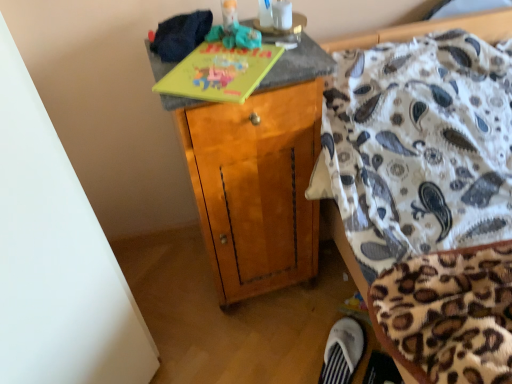
The image size is (512, 384). What are the coordinates of `vacant space situated on the left part of white fabric slipper at lower right` in the screenshot? It's located at (286, 354).